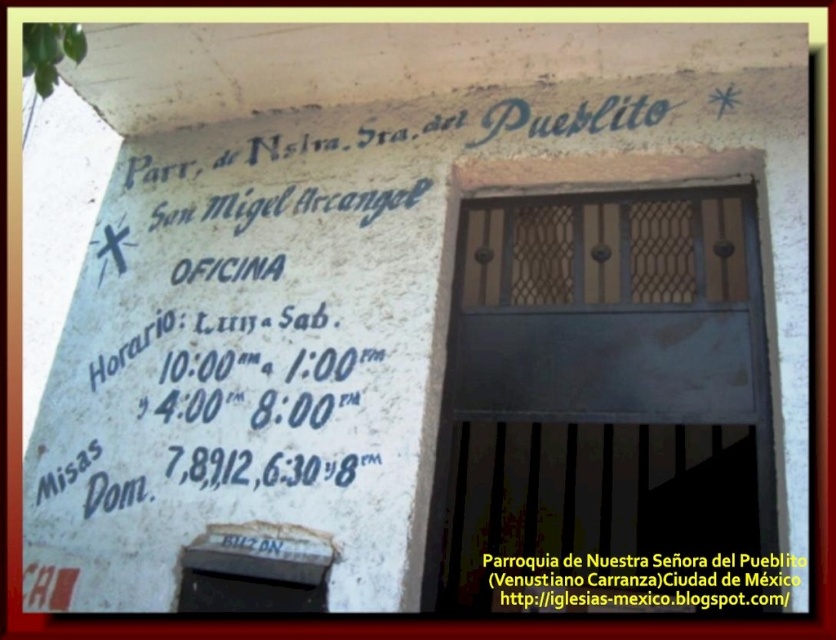
Question: Which of the following is the closest to the observer?

Choices:
 (A) (622, 589)
 (B) (585, 579)

Answer: (A)

Question: Is dark gray metal door at center to the left of white painted text at upper center from the viewer's perspective?

Choices:
 (A) yes
 (B) no

Answer: (A)

Question: Where is dark gray metal door at center located in relation to white painted text at upper center in the image?

Choices:
 (A) below
 (B) above

Answer: (B)

Question: Is the position of dark gray metal door at center less distant than that of white painted text at upper center?

Choices:
 (A) yes
 (B) no

Answer: (B)

Question: Which object is closer to the camera taking this photo?

Choices:
 (A) white painted text at upper center
 (B) dark gray metal door at center

Answer: (A)

Question: Which of the following is the closest to the observer?

Choices:
 (A) dark gray metal door at center
 (B) white painted text at upper center

Answer: (B)